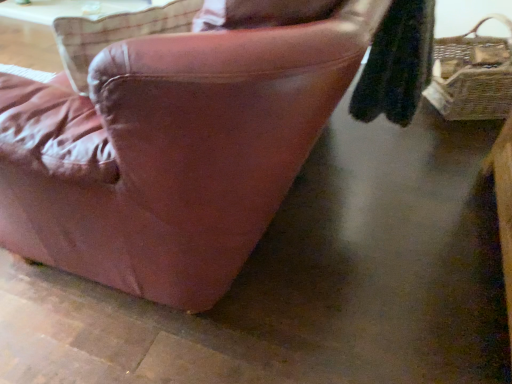
Question: Could natural wicker picnic basket at right be considered to be inside leather couch at center?

Choices:
 (A) no
 (B) yes

Answer: (A)

Question: Is leather couch at center bigger than natural wicker picnic basket at right?

Choices:
 (A) no
 (B) yes

Answer: (B)

Question: From a real-world perspective, is leather couch at center located beneath natural wicker picnic basket at right?

Choices:
 (A) no
 (B) yes

Answer: (B)

Question: Is leather couch at center facing towards natural wicker picnic basket at right?

Choices:
 (A) no
 (B) yes

Answer: (A)

Question: Does leather couch at center have a lesser height compared to natural wicker picnic basket at right?

Choices:
 (A) yes
 (B) no

Answer: (A)

Question: Is leather couch at center with natural wicker picnic basket at right?

Choices:
 (A) no
 (B) yes

Answer: (A)

Question: Is natural wicker picnic basket at right positioned behind leather couch at center?

Choices:
 (A) yes
 (B) no

Answer: (A)

Question: Does natural wicker picnic basket at right have a larger size compared to leather couch at center?

Choices:
 (A) no
 (B) yes

Answer: (A)

Question: Would you say natural wicker picnic basket at right is a long distance from leather couch at center?

Choices:
 (A) no
 (B) yes

Answer: (B)

Question: Would you say natural wicker picnic basket at right is outside leather couch at center?

Choices:
 (A) no
 (B) yes

Answer: (B)

Question: Is natural wicker picnic basket at right thinner than leather couch at center?

Choices:
 (A) no
 (B) yes

Answer: (B)

Question: Does natural wicker picnic basket at right have a lesser height compared to leather couch at center?

Choices:
 (A) yes
 (B) no

Answer: (B)

Question: Is leather couch at center bigger or smaller than natural wicker picnic basket at right?

Choices:
 (A) small
 (B) big

Answer: (B)